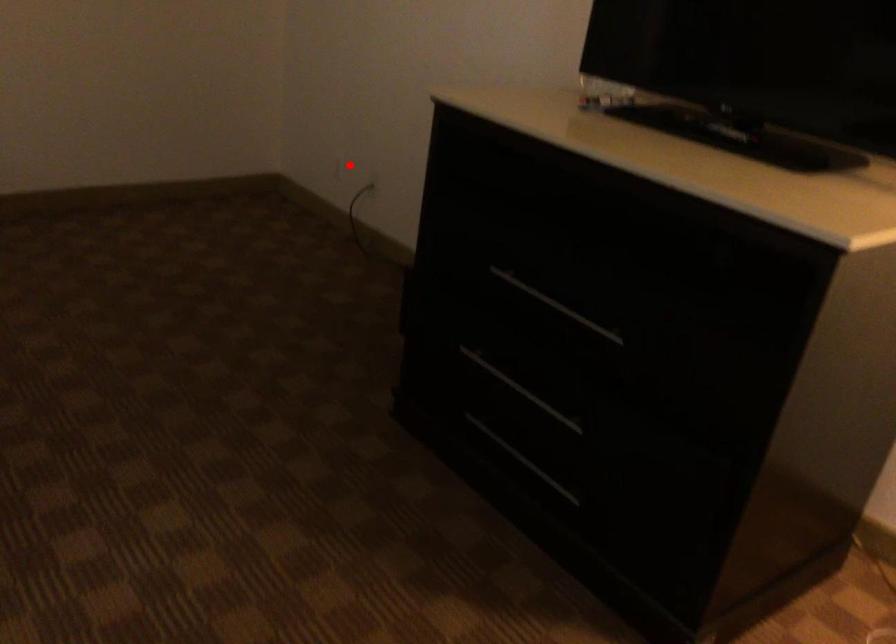
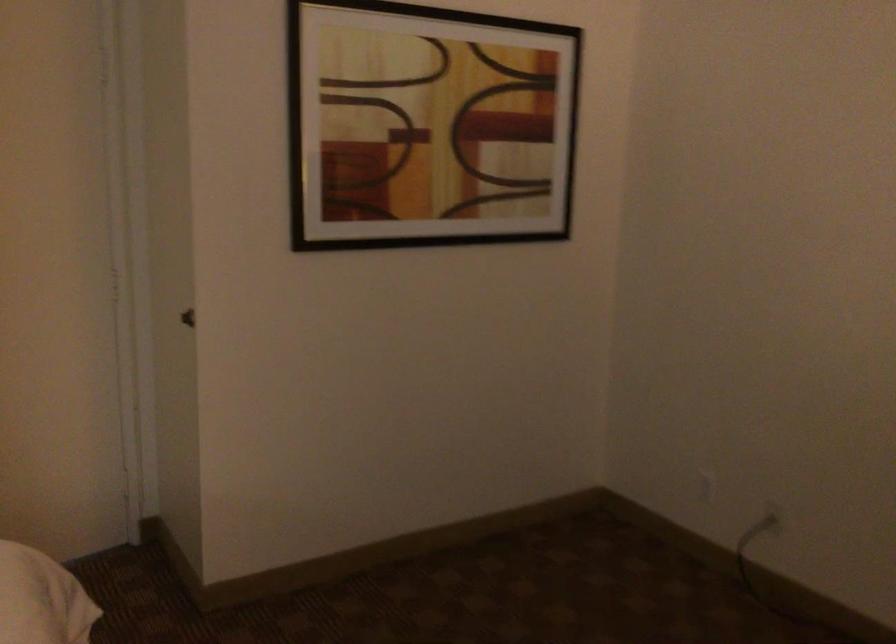
Question: I am providing you with two images of the same scene from different viewpoints. In image1, a red point is highlighted. Considering the same 3D point in image2, which of the following is correct?

Choices:
 (A) It is closer
 (B) It is farther

Answer: (A)